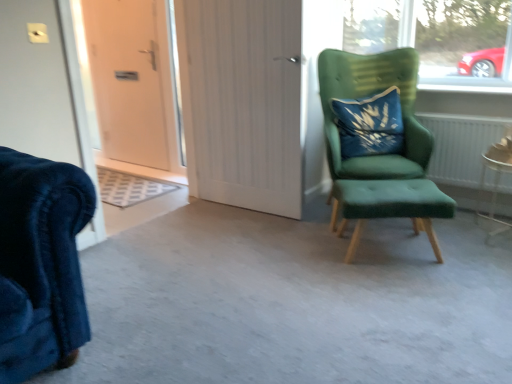
Find the location of `free space that is to the left of metallic silver side table at lower right`. free space that is to the left of metallic silver side table at lower right is located at coordinates (455, 232).